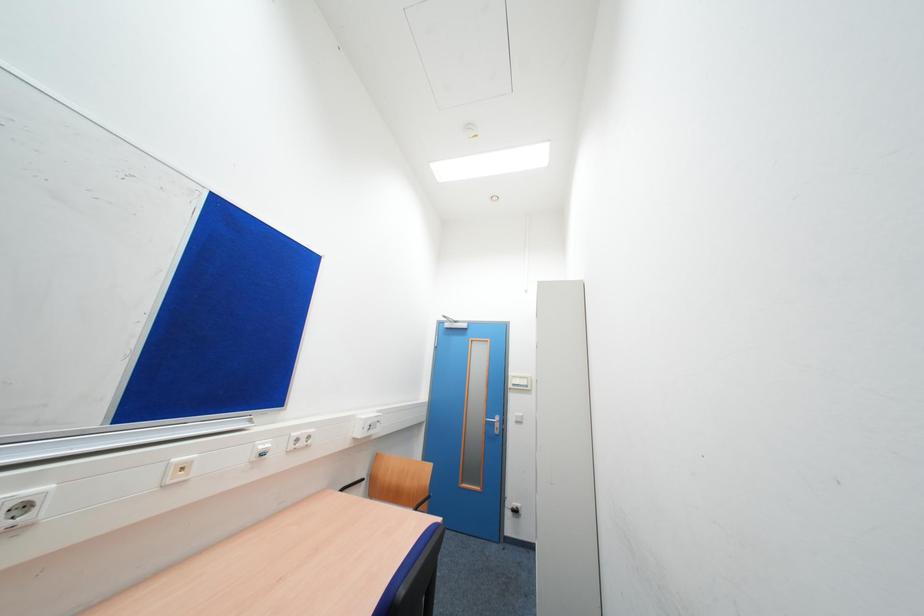
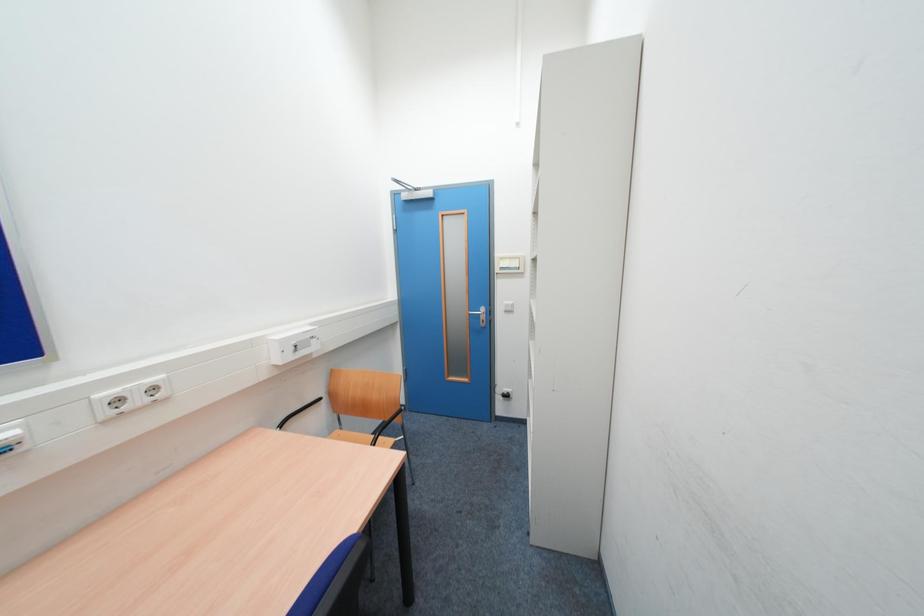
Question: In a continuous first-person perspective shot, in which direction is the camera moving?

Choices:
 (A) Left
 (B) Right
 (C) Forward
 (D) Backward

Answer: (C)